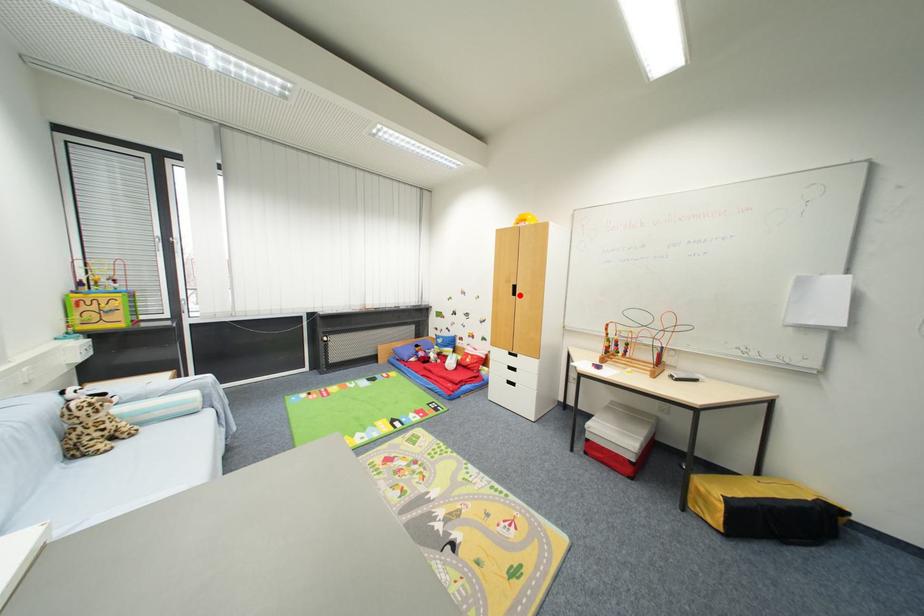
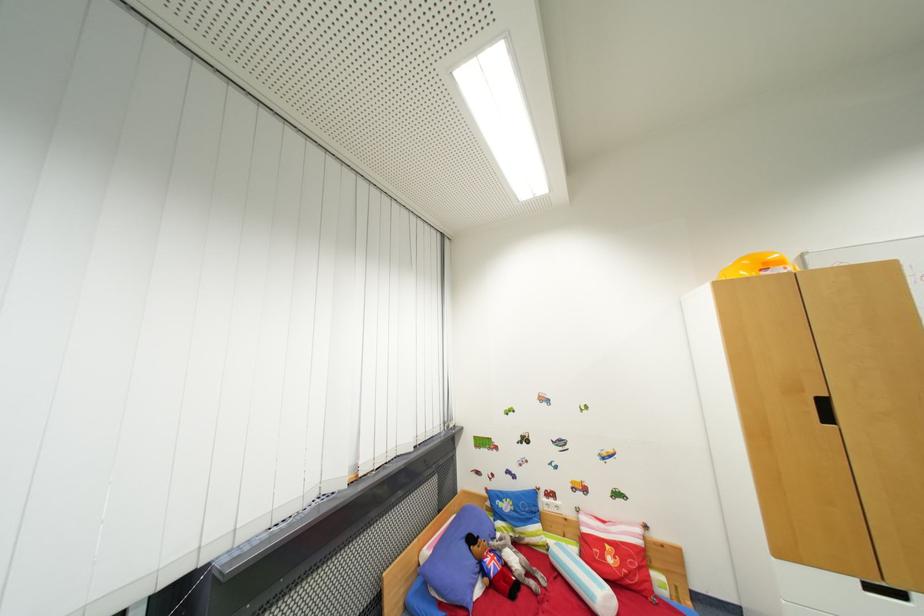
Question: A red point is marked in image1. In image2, is the corresponding 3D point closer to the camera or farther? Reply with the corresponding letter.

Choices:
 (A) The corresponding 3D point is closer.
 (B) The corresponding 3D point is farther.

Answer: (A)